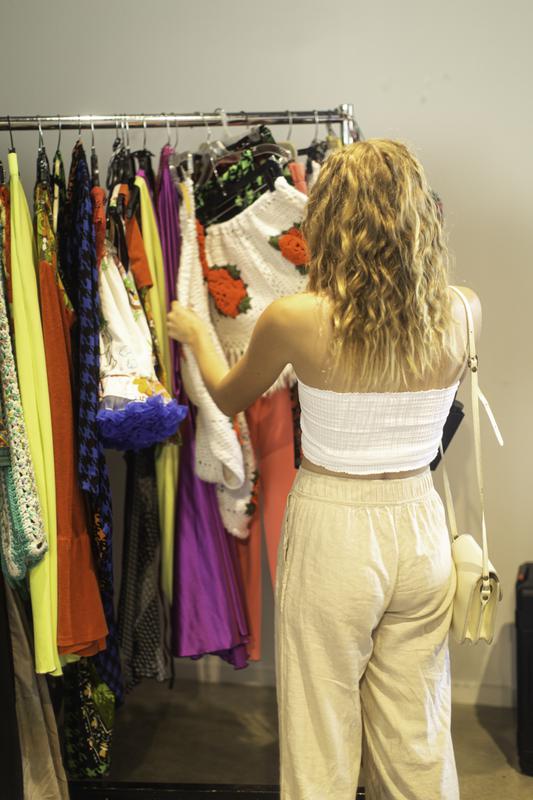
At what (x,y) coordinates should I click in order to perform the action: click on white wall. Please return your answer as a coordinate pair (x, y). The height and width of the screenshot is (800, 533). Looking at the image, I should click on (511, 502).